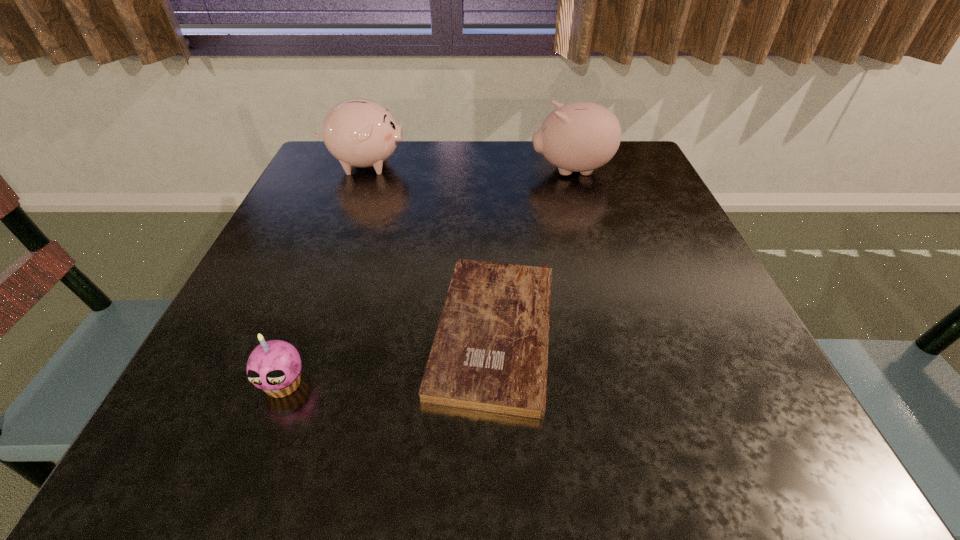
Locate an element on the screen. This screenshot has width=960, height=540. blank region between the left piggy bank and the shortest object is located at coordinates (429, 248).

Choose which object is the second nearest neighbor to the right piggy bank. Please provide its 2D coordinates. Your answer should be formatted as a tuple, i.e. [(x, y)], where the tuple contains the x and y coordinates of a point satisfying the conditions above.

[(358, 132)]

Identify which object is located as the third nearest to the left piggy bank. Please provide its 2D coordinates. Your answer should be formatted as a tuple, i.e. [(x, y)], where the tuple contains the x and y coordinates of a point satisfying the conditions above.

[(276, 361)]

Where is `free space that satisfies the following two spatial constraints: 1. at the snout of the right piggy bank; 2. on the face of the third tallest object`? The height and width of the screenshot is (540, 960). free space that satisfies the following two spatial constraints: 1. at the snout of the right piggy bank; 2. on the face of the third tallest object is located at coordinates (635, 384).

The height and width of the screenshot is (540, 960). In order to click on free spot that satisfies the following two spatial constraints: 1. at the snout of the right piggy bank; 2. on the front side of the Bible in this screenshot , I will do `click(619, 332)`.

Find the location of a particular element. vacant position in the image that satisfies the following two spatial constraints: 1. at the snout of the right piggy bank; 2. on the face of the third tallest object is located at coordinates [x=635, y=384].